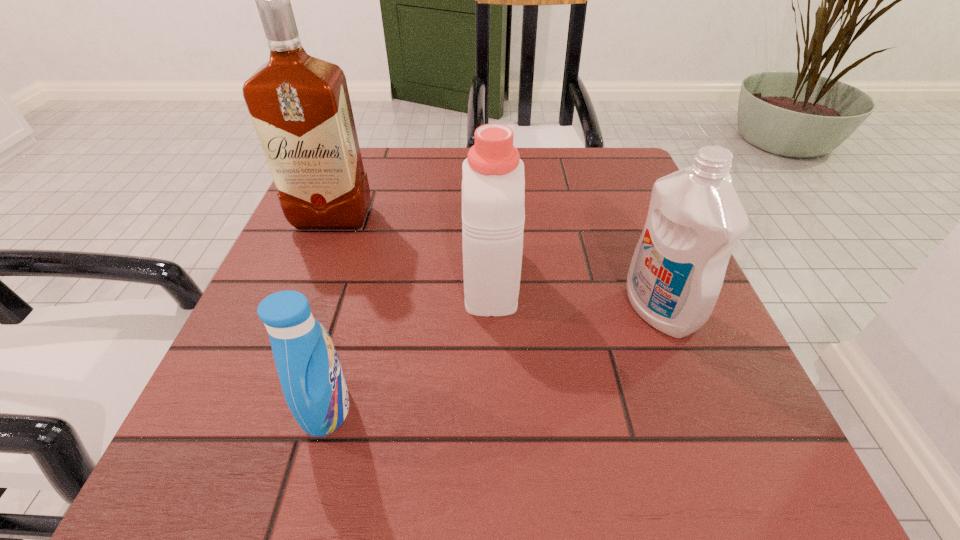
The width and height of the screenshot is (960, 540). What are the coordinates of `free region at the right edge` in the screenshot? It's located at (605, 205).

Locate an element on the screen. free location at the far right corner of the desktop is located at coordinates (609, 173).

The image size is (960, 540). Find the location of `free space between the liquor and the second object from right to left`. free space between the liquor and the second object from right to left is located at coordinates (412, 248).

Identify the location of empty space between the second object from right to left and the tallest object. (412, 248).

This screenshot has width=960, height=540. Identify the location of free space between the leftmost detergent and the rightmost detergent. coord(493,359).

What are the coordinates of `free space that is in between the second detergent from left to right and the farthest object` in the screenshot? It's located at coord(412,248).

You are a GUI agent. You are given a task and a screenshot of the screen. Output one action in this format:
    pyautogui.click(x=<x>, y=<y>)
    Task: Click on the vacant area that lies between the nearest detergent and the second detergent from right to left
    
    Given the screenshot: What is the action you would take?
    pyautogui.click(x=409, y=343)

Choose which object is the second nearest neighbor to the leftmost detergent. Please provide its 2D coordinates. Your answer should be formatted as a tuple, i.e. [(x, y)], where the tuple contains the x and y coordinates of a point satisfying the conditions above.

[(300, 106)]

This screenshot has width=960, height=540. What are the coordinates of `the third closest object to the nearest detergent` in the screenshot? It's located at (x=695, y=219).

Locate an element on the screen. detergent that can be found as the third closest to the tallest object is located at coordinates (695, 219).